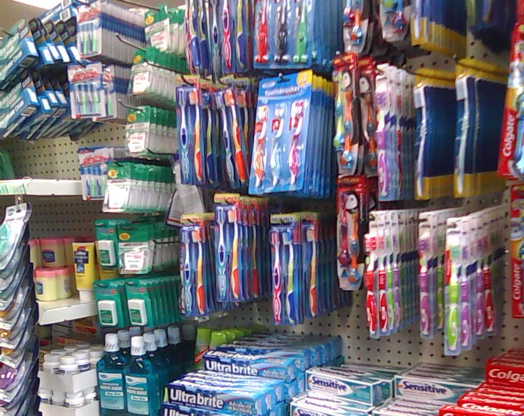
Where is `ceiling`? This screenshot has height=416, width=524. ceiling is located at coordinates (10, 12).